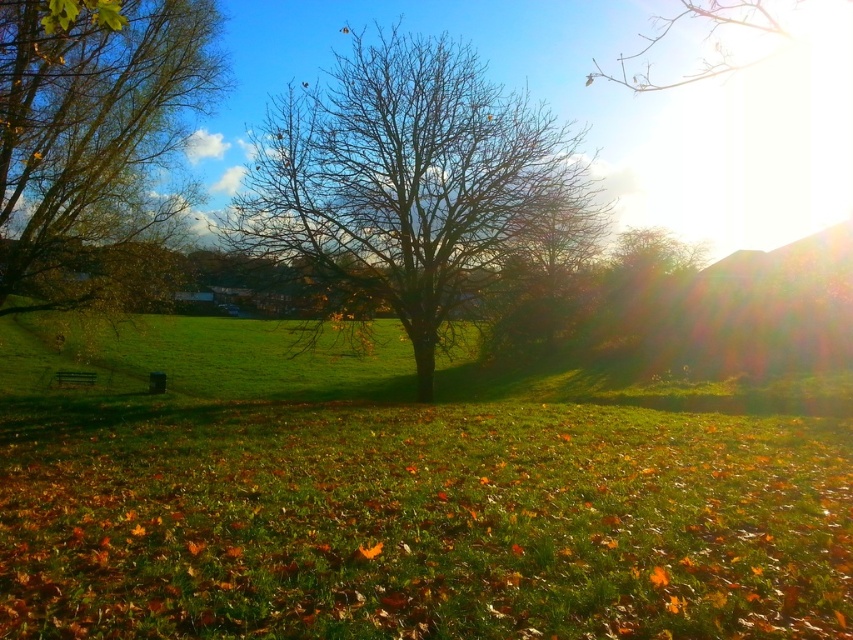
Is bare branches at center shorter than brown leafy tree at left?

In fact, bare branches at center may be taller than brown leafy tree at left.

Between point (521, 145) and point (1, 115), which one is positioned in front?

Point (1, 115)

Between point (381, 138) and point (73, 13), which one is positioned behind?

Positioned behind is point (381, 138).

This screenshot has width=853, height=640. Identify the location of bare branches at center. click(410, 180).